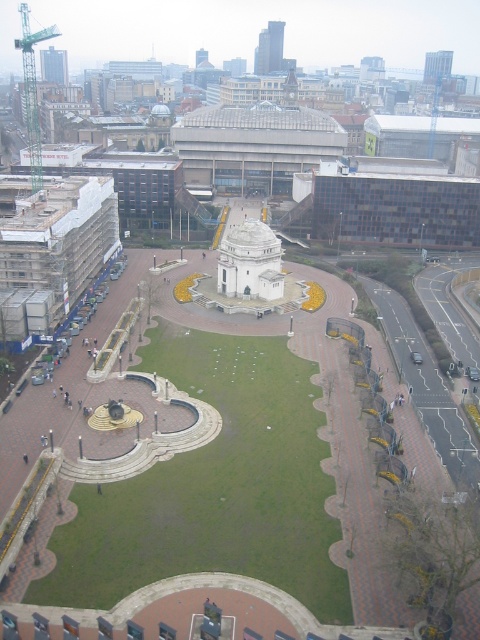
Can you confirm if smooth glass skyscraper at upper center is shorter than matte glass tower at upper left?

In fact, smooth glass skyscraper at upper center may be taller than matte glass tower at upper left.

Which is behind, point (275, 24) or point (68, 80)?

Positioned behind is point (68, 80).

Where is `smooth glass skyscraper at upper center`? smooth glass skyscraper at upper center is located at coordinates (269, 49).

You are a GUI agent. You are given a task and a screenshot of the screen. Output one action in this format:
    pyautogui.click(x=<x>, y=<y>)
    Task: Click on the smooth glass skyscraper at upper center
    The width and height of the screenshot is (480, 640).
    Given the screenshot: What is the action you would take?
    pyautogui.click(x=269, y=49)

Identify the location of matte glass tower at upper left. This screenshot has width=480, height=640. (54, 65).

Is matte glass tower at upper left to the right of glassy skyscraper at upper right from the viewer's perspective?

No, matte glass tower at upper left is not to the right of glassy skyscraper at upper right.

Between point (57, 77) and point (424, 58), which one is positioned behind?

Positioned behind is point (424, 58).

Where is `matte glass tower at upper left`? This screenshot has width=480, height=640. matte glass tower at upper left is located at coordinates (54, 65).

Between point (34, 64) and point (60, 76), which one is positioned behind?

Positioned behind is point (34, 64).

You are a GUI agent. You are given a task and a screenshot of the screen. Output one action in this format:
    pyautogui.click(x=<x>, y=<y>)
    Task: Click on the green metallic crane at upper left
    The image size is (480, 640).
    Given the screenshot: What is the action you would take?
    pyautogui.click(x=32, y=90)

Which is behind, point (24, 44) or point (58, 83)?

The point (58, 83) is more distant.

This screenshot has width=480, height=640. In order to click on green metallic crane at upper left in this screenshot , I will do `click(32, 90)`.